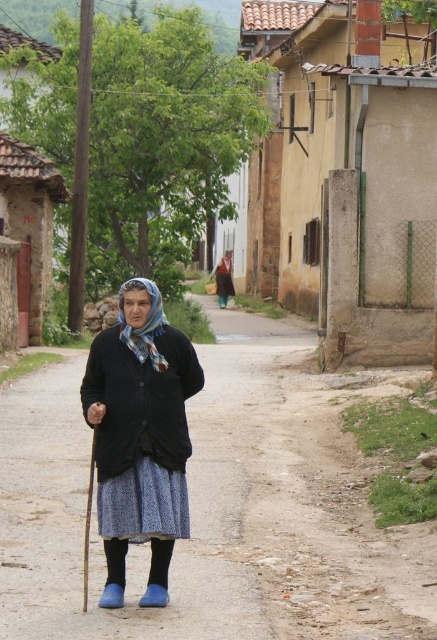
Question: Which point appears closest to the camera in this image?

Choices:
 (A) [253, 179]
 (B) [270, 320]
 (C) [107, 544]

Answer: (C)

Question: Which object appears farthest from the camera in this image?

Choices:
 (A) dirt road at center
 (B) matte black cardigan at center
 (C) blue patterned scarf at center

Answer: (C)

Question: Which point is farther from the camera taking this photo?

Choices:
 (A) (92, 202)
 (B) (92, 419)
 (C) (291, 452)
 (D) (152, 285)

Answer: (A)

Question: Is dirt road at center positioned in front of matte black cardigan at center?

Choices:
 (A) no
 (B) yes

Answer: (B)

Question: Can you confirm if dirt road at center is positioned below blue patterned scarf at center?

Choices:
 (A) yes
 (B) no

Answer: (A)

Question: Can you confirm if black woolen sweater at center is thinner than matte black cardigan at center?

Choices:
 (A) yes
 (B) no

Answer: (B)